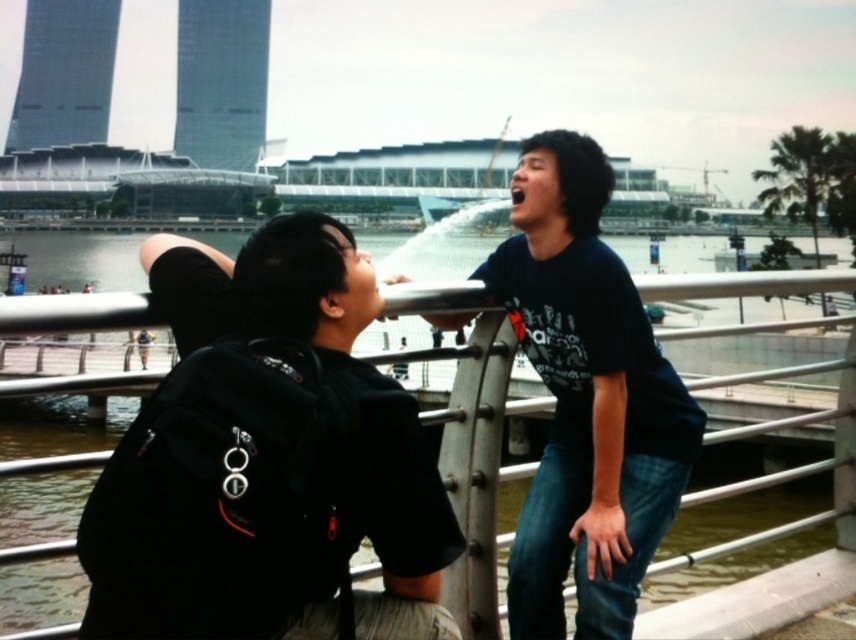
Question: Is black matte backpack at center bigger than black cotton t-shirt at center?

Choices:
 (A) yes
 (B) no

Answer: (B)

Question: Which point is farther from the camera taking this photo?

Choices:
 (A) (49, 296)
 (B) (265, 605)

Answer: (A)

Question: Which object is positioned closest to the black matte backpack at center?

Choices:
 (A) metallic gray rail at center
 (B) black cotton t-shirt at center

Answer: (B)

Question: Is black matte backpack at center further to camera compared to metallic gray rail at center?

Choices:
 (A) no
 (B) yes

Answer: (B)

Question: Which of the following is the closest to the observer?

Choices:
 (A) metallic gray rail at center
 (B) black matte backpack at center

Answer: (A)

Question: Can you confirm if black matte backpack at center is smaller than metallic gray rail at center?

Choices:
 (A) no
 (B) yes

Answer: (B)